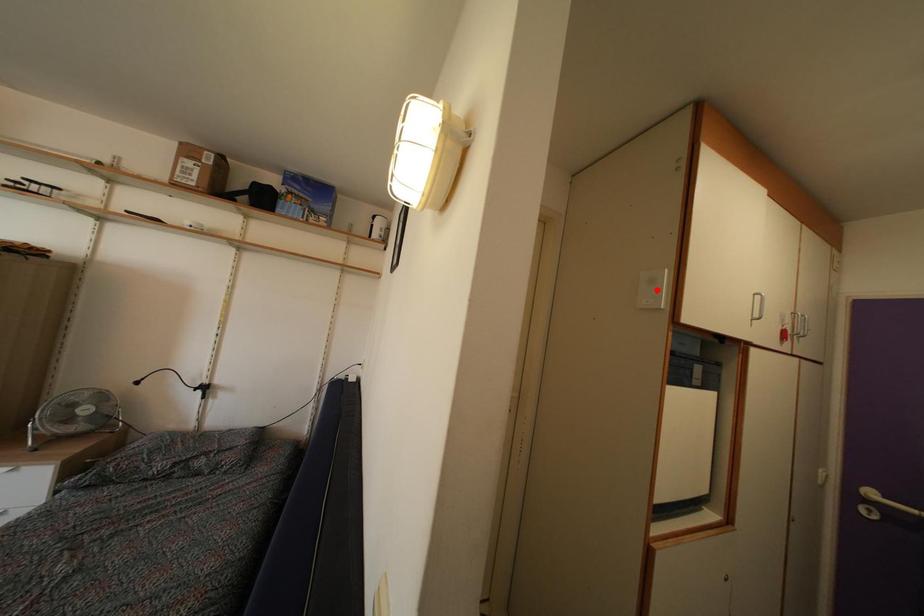
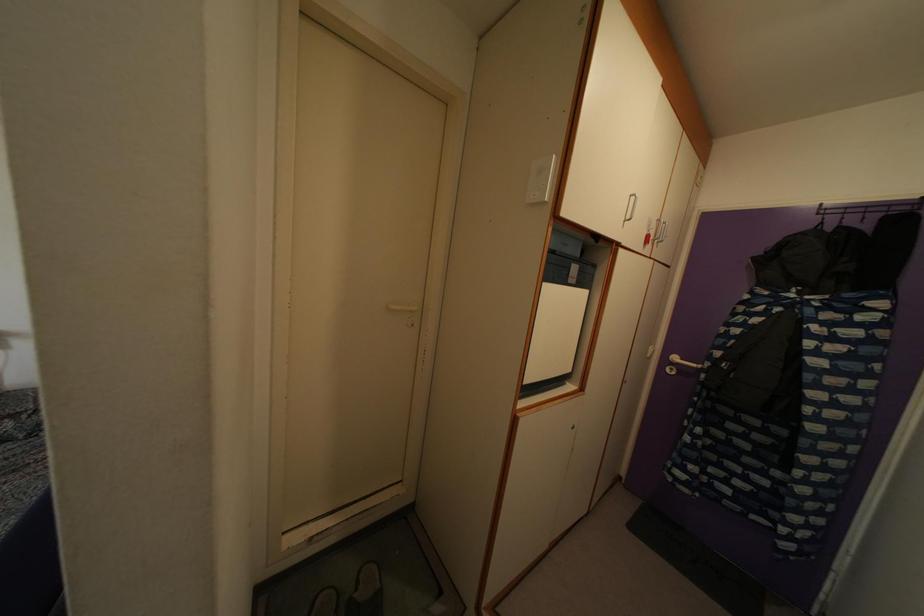
The point at the highlighted location is marked in the first image. Where is the corresponding point in the second image?

(544, 180)